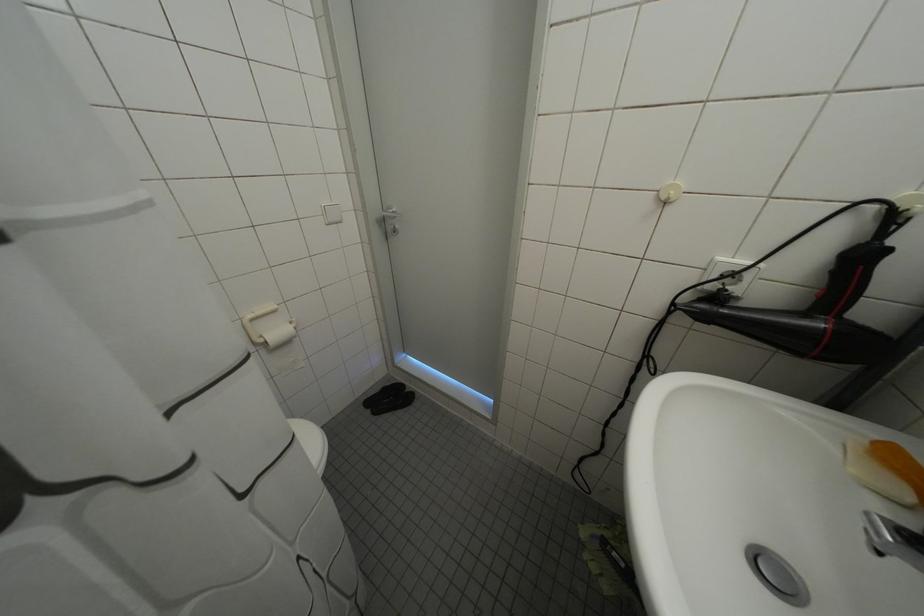
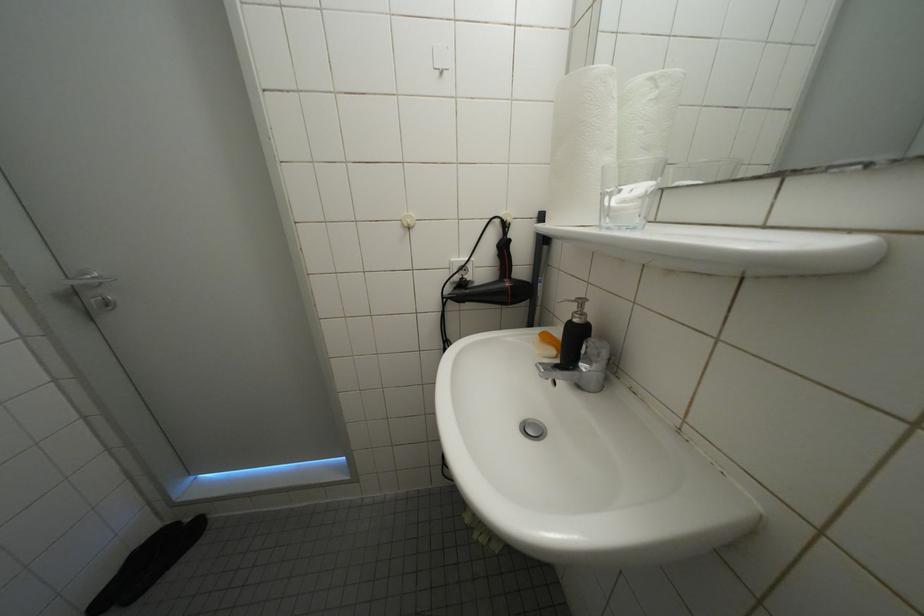
Question: How did the camera likely rotate?

Choices:
 (A) Left
 (B) Right
 (C) Up
 (D) Down

Answer: (B)